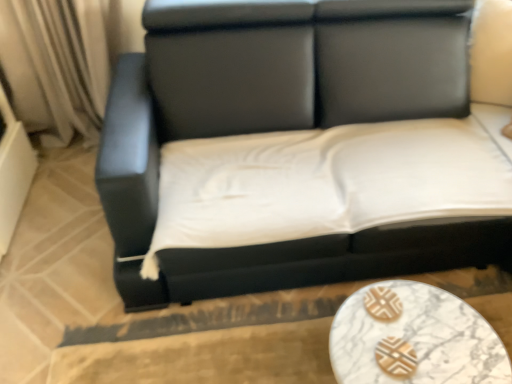
Question: Is white marble table at lower center shorter than black leather couch at center?

Choices:
 (A) no
 (B) yes

Answer: (B)

Question: Is white marble table at lower center oriented away from black leather couch at center?

Choices:
 (A) yes
 (B) no

Answer: (A)

Question: Would you say white marble table at lower center is outside black leather couch at center?

Choices:
 (A) no
 (B) yes

Answer: (B)

Question: Does white marble table at lower center appear on the left side of black leather couch at center?

Choices:
 (A) no
 (B) yes

Answer: (A)

Question: Considering the relative sizes of white marble table at lower center and black leather couch at center in the image provided, is white marble table at lower center smaller than black leather couch at center?

Choices:
 (A) no
 (B) yes

Answer: (B)

Question: From a real-world perspective, is white marble table at lower center physically below black leather couch at center?

Choices:
 (A) yes
 (B) no

Answer: (A)

Question: Can you confirm if black leather couch at center is wider than white marble table at lower center?

Choices:
 (A) yes
 (B) no

Answer: (A)

Question: From a real-world perspective, is black leather couch at center over white marble table at lower center?

Choices:
 (A) no
 (B) yes

Answer: (B)

Question: Is black leather couch at center turned away from white marble table at lower center?

Choices:
 (A) yes
 (B) no

Answer: (B)

Question: From the image's perspective, is black leather couch at center on top of white marble table at lower center?

Choices:
 (A) no
 (B) yes

Answer: (B)

Question: Does black leather couch at center touch white marble table at lower center?

Choices:
 (A) yes
 (B) no

Answer: (B)

Question: Is black leather couch at center at the left side of white marble table at lower center?

Choices:
 (A) yes
 (B) no

Answer: (A)

Question: In terms of size, does white marble table at lower center appear bigger or smaller than black leather couch at center?

Choices:
 (A) big
 (B) small

Answer: (B)